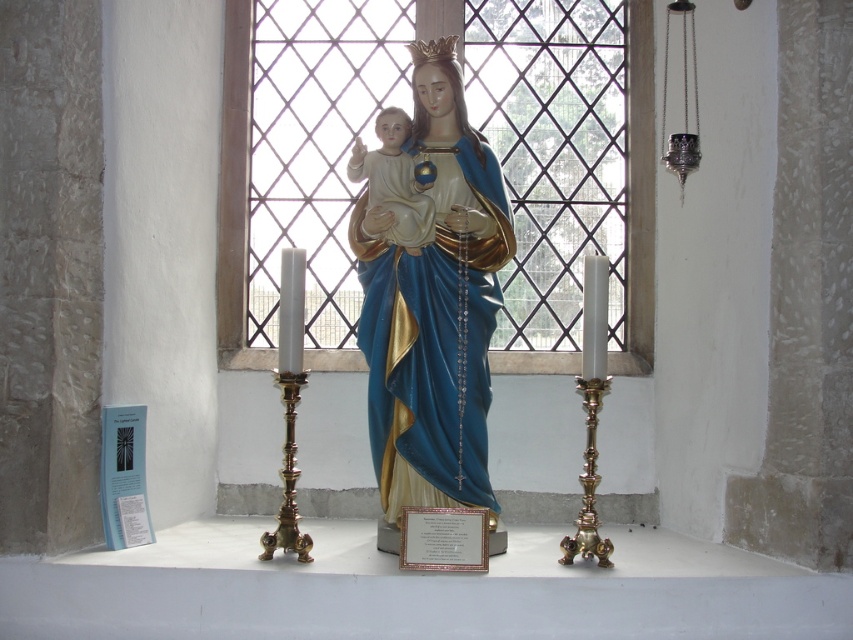
You are an art curator planning to display the matte blue statue at center and the matte porcelain baby at center in a new exhibition. The museum requires that the baby must be placed on a platform so that its height matches the statue. How much taller should the platform be than the baby?

The matte blue statue at center is larger in size compared to the matte porcelain baby at center. To make their heights match, the platform for the baby should be elevated by the difference in their heights.

You are a maintenance worker in the church and need to clean the clear glass window at center and the matte porcelain baby at center. You have a 3 feet long pole. Can you reach both objects from your current position without moving closer?

The clear glass window at center is 3.42 feet away from the matte porcelain baby at center. Since the pole is only 3 feet long, it is not long enough to reach either object from your current position. You will need to move closer to clean them.

You are standing in the chapel and want to light the candles on the two tall ornate candlesticks flanking the statue. You have a lighter in your pocket. Considering the clear glass window at center is between you and the candlesticks, can you reach the candles without touching the window?

The clear glass window at center is 5.50 meters away from the viewer. Since the window is between you and the candlesticks, you would need to reach around or past the window, but the distance suggests the candlesticks are further away than the window. Therefore, you cannot directly reach the candles without moving closer or using a tool.